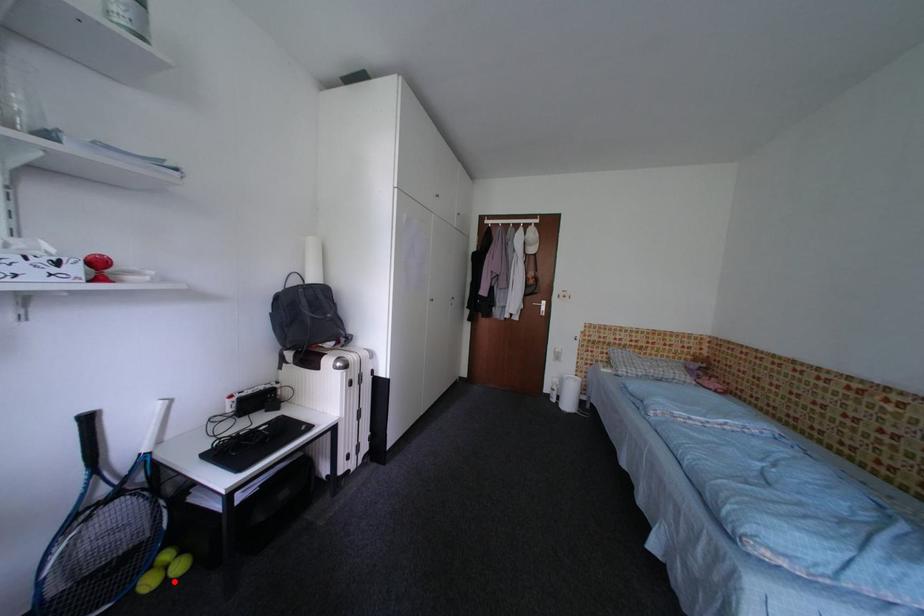
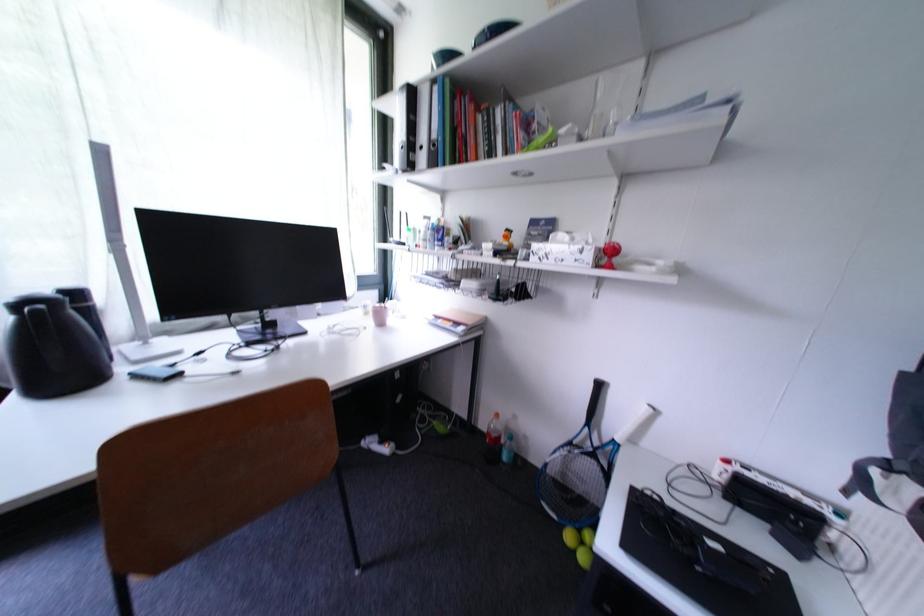
Where in the second image is the point corresponding to the highlighted location from the first image?

(582, 554)